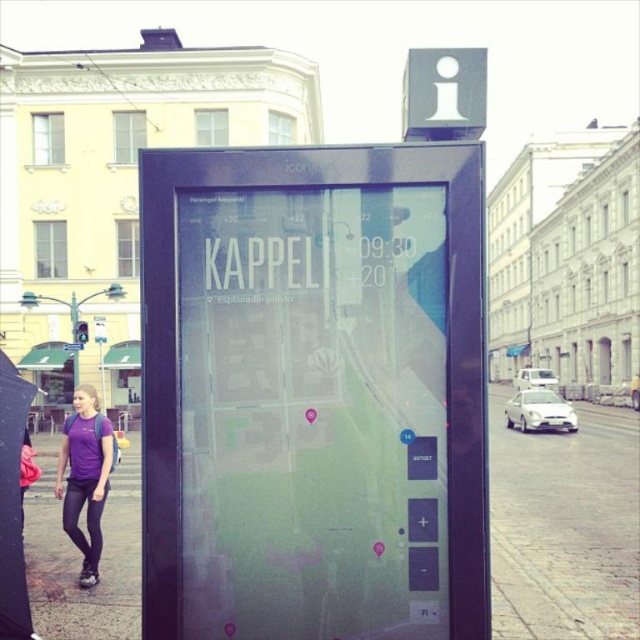
What do you see at coordinates (564, 528) in the screenshot?
I see `matte glass pavement at lower left` at bounding box center [564, 528].

Which of these two, matte glass pavement at lower left or purple fabric shirt at lower left, stands shorter?

purple fabric shirt at lower left is shorter.

Is point (618, 561) closer to camera compared to point (100, 548)?

No, (618, 561) is further to viewer.

The height and width of the screenshot is (640, 640). Find the location of `matte glass pavement at lower left`. matte glass pavement at lower left is located at coordinates (564, 528).

Who is taller, transparent glass information kiosk at center or brick pavement at lower right?

Standing taller between the two is brick pavement at lower right.

Is transparent glass information kiosk at center further to the viewer compared to brick pavement at lower right?

That is False.

Locate an element on the screen. The width and height of the screenshot is (640, 640). transparent glass information kiosk at center is located at coordinates (314, 394).

Does brick pavement at lower right have a smaller size compared to purple fabric shirt at lower left?

No, brick pavement at lower right is not smaller than purple fabric shirt at lower left.

Who is lower down, brick pavement at lower right or purple fabric shirt at lower left?

brick pavement at lower right

Is point (541, 438) less distant than point (99, 506)?

No, (541, 438) is behind (99, 506).

Locate an element on the screen. The width and height of the screenshot is (640, 640). brick pavement at lower right is located at coordinates (564, 525).